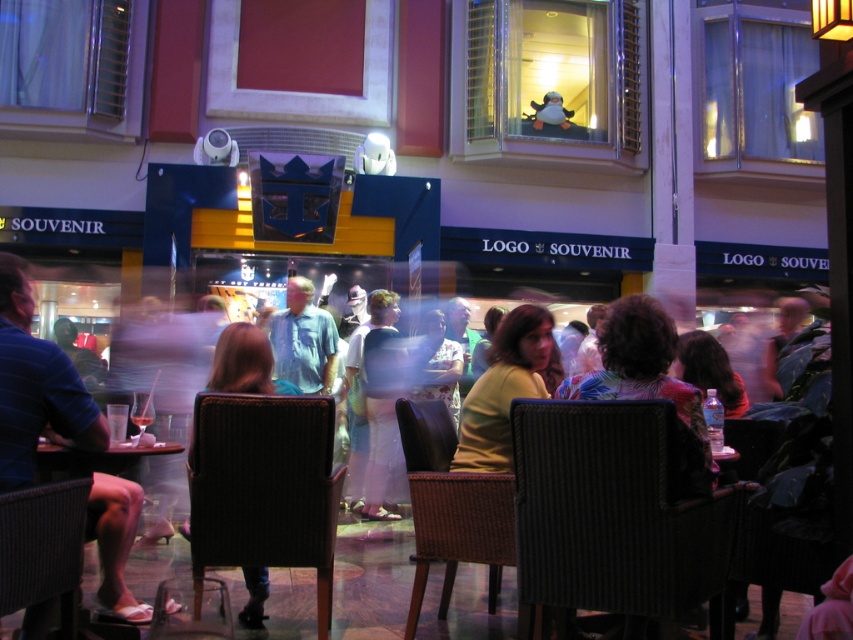
Question: Considering the relative positions of yellow matte shirt at center and blue cotton shirt at center in the image provided, where is yellow matte shirt at center located with respect to blue cotton shirt at center?

Choices:
 (A) below
 (B) above

Answer: (A)

Question: Can you confirm if black woven chair at lower right is positioned to the left of wooden table at lower left?

Choices:
 (A) yes
 (B) no

Answer: (B)

Question: Which object is the farthest from the blue cotton shirt at center?

Choices:
 (A) woven dark brown chair at lower right
 (B) wooden table at lower left

Answer: (A)

Question: Which of the following is the farthest from the observer?

Choices:
 (A) (106, 579)
 (B) (775, 604)
 (C) (36, 540)

Answer: (B)

Question: Does dark brown woven chair at lower left appear over blue cotton shirt at center?

Choices:
 (A) yes
 (B) no

Answer: (B)

Question: Which object appears closest to the camera in this image?

Choices:
 (A) woven brown chair at lower center
 (B) wooden table at lower left
 (C) dark brown woven chair at lower left

Answer: (C)